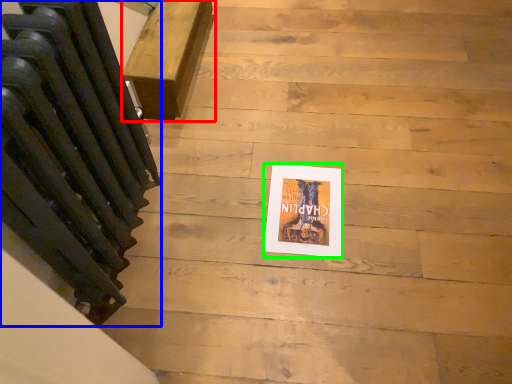
Question: Which object is the closest to the furniture (highlighted by a red box)? Choose among these: radiator (highlighted by a blue box) or flyer (highlighted by a green box).

Choices:
 (A) radiator
 (B) flyer

Answer: (A)